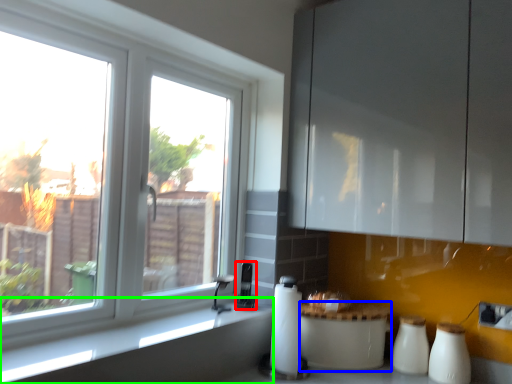
Question: Which object is positioned farthest from appliance (highlighted by a red box)? Select from appliance (highlighted by a blue box) and counter top (highlighted by a green box).

Choices:
 (A) appliance
 (B) counter top

Answer: (B)